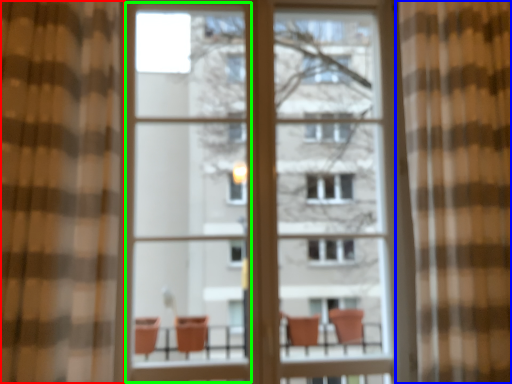
Question: Which object is the farthest from curtain (highlighted by a red box)? Choose among these: curtain (highlighted by a blue box) or screen door (highlighted by a green box).

Choices:
 (A) curtain
 (B) screen door

Answer: (A)